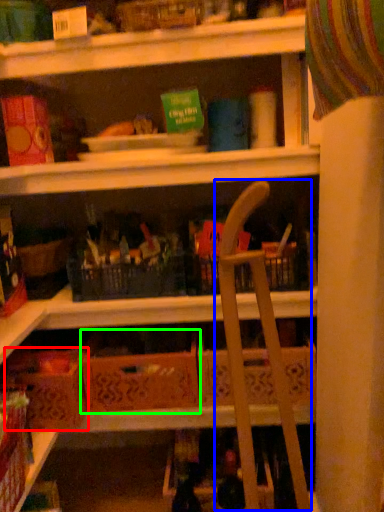
Question: Based on their relative distances, which object is nearer to cardboard box (highlighted by a red box)? Choose from folding chair (highlighted by a blue box) and cardboard box (highlighted by a green box).

Choices:
 (A) folding chair
 (B) cardboard box

Answer: (B)